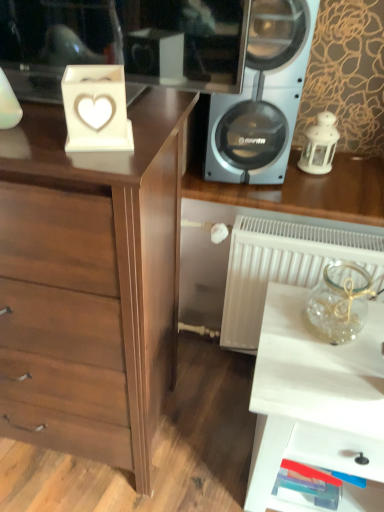
The image size is (384, 512). Identify the location of empty space that is to the right of silver metallic speaker at upper right. (341, 176).